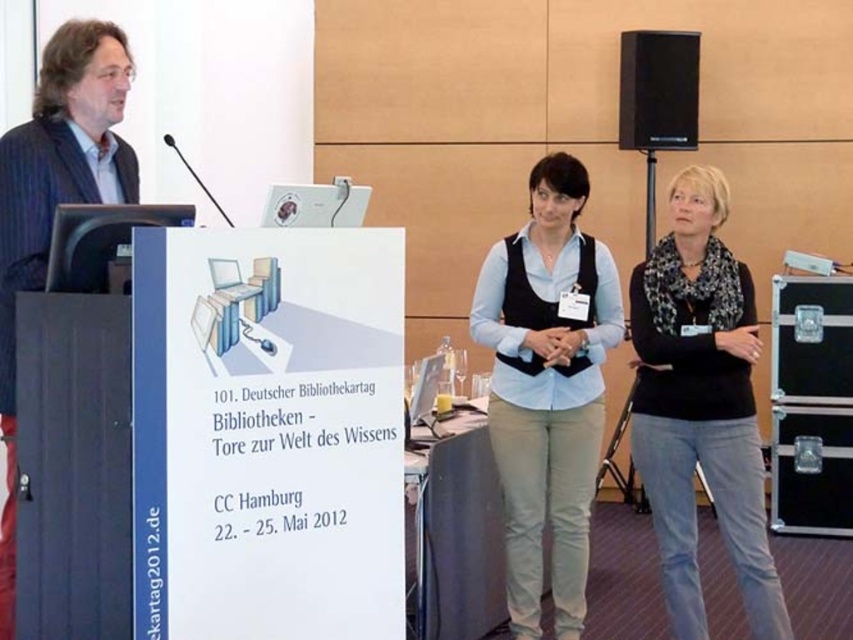
You are a photographer at the event and need to capture a group photo of the light blue cotton shirt at center and the dark blue suit at left. The camera frame can only accommodate one person at a time. Which person should you photograph first to ensure their full body fits in the frame?

The light blue cotton shirt at center might be wider than dark blue suit at left, so you should photograph the light blue cotton shirt at center first to ensure the frame can accommodate their width.

You are attending the 101st German Library Day conference and notice the black knitwear at right. If you want to retrieve it without leaving your seat, can you reach it from where you are sitting?

The black knitwear at right is 10.97 feet away from the camera, which is likely your seat. Since this distance is quite far, you probably cannot reach it without moving from your seat.